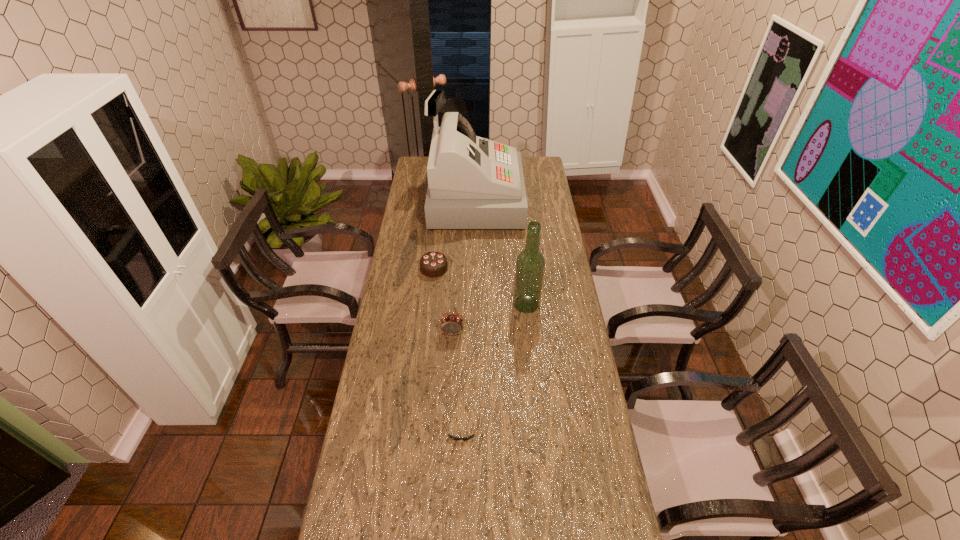
Locate an element on the screen. Image resolution: width=960 pixels, height=540 pixels. vacant space located on the keypad side of the cash register is located at coordinates (544, 200).

Locate an element on the screen. free point located on the back of the second tallest object is located at coordinates (519, 234).

Where is `blank space located 0.340m on the face of the fourth shortest object`? blank space located 0.340m on the face of the fourth shortest object is located at coordinates [x=447, y=423].

Identify the location of vacant space situated 0.350m on the right of the third shortest object. The image size is (960, 540). (530, 268).

Where is `vacant space located on the front-facing side of the fifth tallest object`? The image size is (960, 540). vacant space located on the front-facing side of the fifth tallest object is located at coordinates (460, 468).

The width and height of the screenshot is (960, 540). In order to click on object at the far edge in this screenshot , I will do `click(473, 183)`.

This screenshot has width=960, height=540. I want to click on cash register at the left edge, so click(x=473, y=183).

Locate an element on the screen. chocolate cake positioned at the left edge is located at coordinates pos(434,264).

Find the location of a particular element. The width and height of the screenshot is (960, 540). cash register that is at the right edge is located at coordinates click(x=473, y=183).

This screenshot has width=960, height=540. I want to click on liquor that is at the right edge, so 530,264.